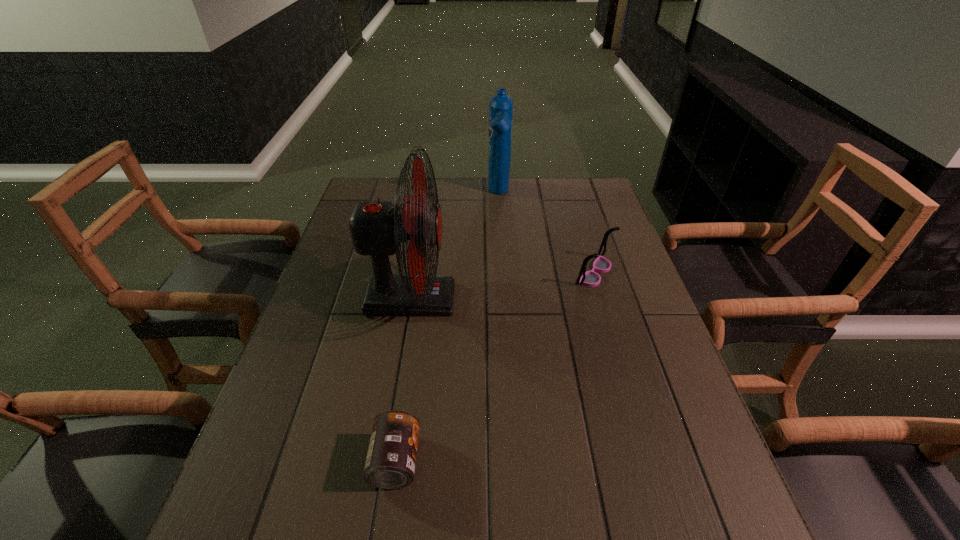
Select which object appears as the second closest to the fan. Please provide its 2D coordinates. Your answer should be formatted as a tuple, i.e. [(x, y)], where the tuple contains the x and y coordinates of a point satisfying the conditions above.

[(500, 105)]

Where is `vacant point that satisfies the following two spatial constraints: 1. on the front side of the rightmost object; 2. on the left side of the third shortest object`? vacant point that satisfies the following two spatial constraints: 1. on the front side of the rightmost object; 2. on the left side of the third shortest object is located at coordinates (504, 273).

Locate an element on the screen. This screenshot has height=540, width=960. free space that satisfies the following two spatial constraints: 1. on the front side of the farthest object; 2. on the front-facing side of the fan is located at coordinates (505, 299).